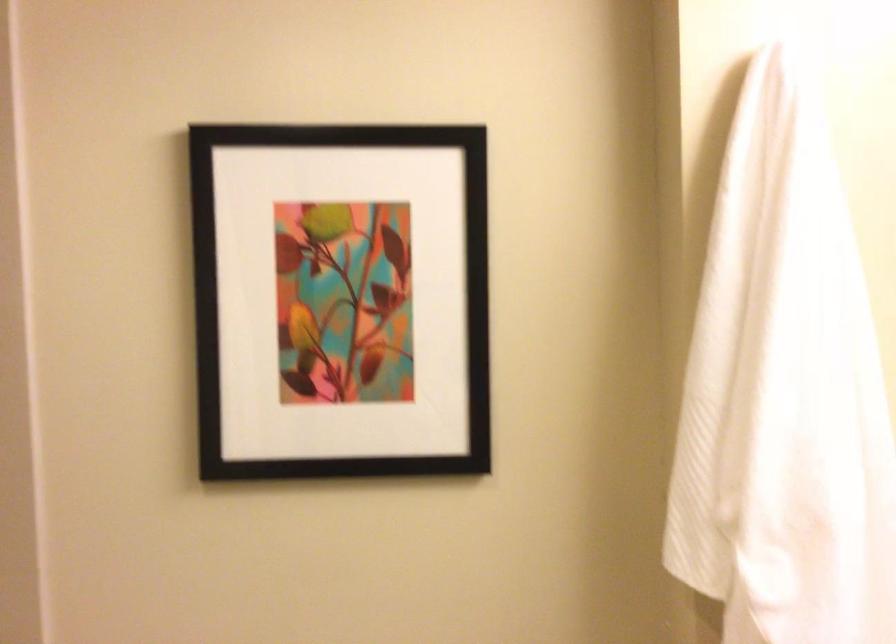
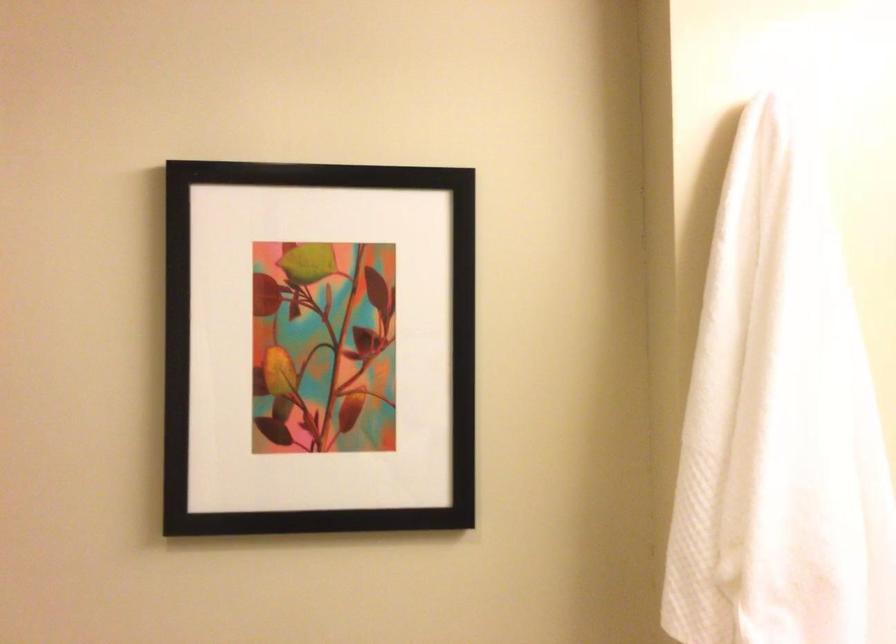
Question: How did the camera likely rotate?

Choices:
 (A) Left
 (B) Right
 (C) Up
 (D) Down

Answer: (C)